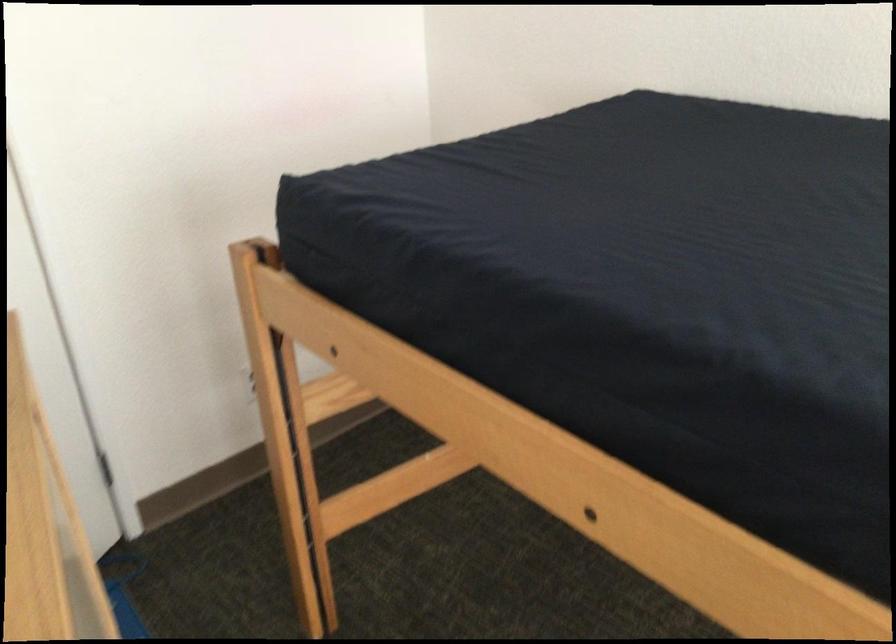
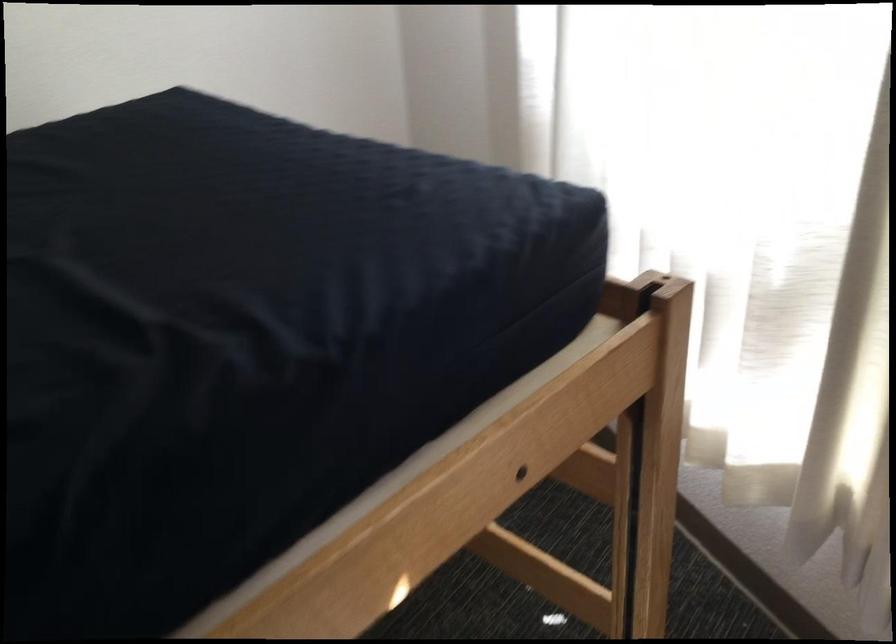
The images are taken continuously from a first-person perspective. In which direction is your viewpoint rotating?

The rotation direction of the camera is right-down.